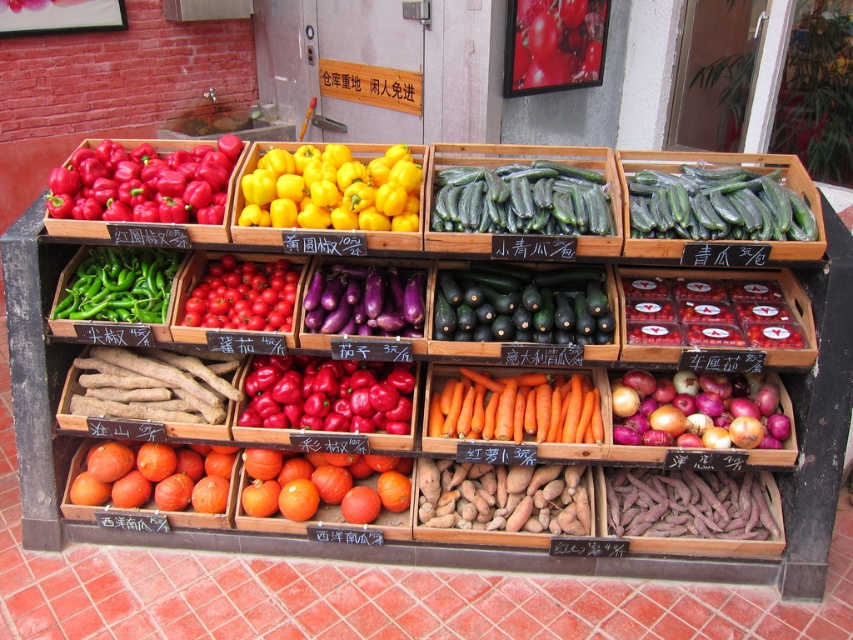
Question: Can you confirm if yellow matte bell pepper at center is positioned to the left of red matte onions at bottom right?

Choices:
 (A) yes
 (B) no

Answer: (A)

Question: Which point is closer to the camera?

Choices:
 (A) yellow matte bell pepper at center
 (B) purple matte sweet potato at lower right

Answer: (A)

Question: Does orange smooth carrot at center have a smaller size compared to green glossy chili peppers at left?

Choices:
 (A) no
 (B) yes

Answer: (A)

Question: Which is nearer to the purple matte sweet potato at lower right?

Choices:
 (A) orange smooth carrot at center
 (B) green smooth cucumber at center
 (C) green glossy chili peppers at left

Answer: (A)

Question: Considering the real-world distances, which object is farthest from the red matte tomatoes at center?

Choices:
 (A) green smooth skin zucchini at center
 (B) green glossy chili peppers at left
 (C) red glossy tomatoes at upper center
 (D) red matte onions at bottom right

Answer: (C)

Question: Where is green matte zucchini at center located in relation to orange matte tomatoes at center in the image?

Choices:
 (A) right
 (B) left

Answer: (A)